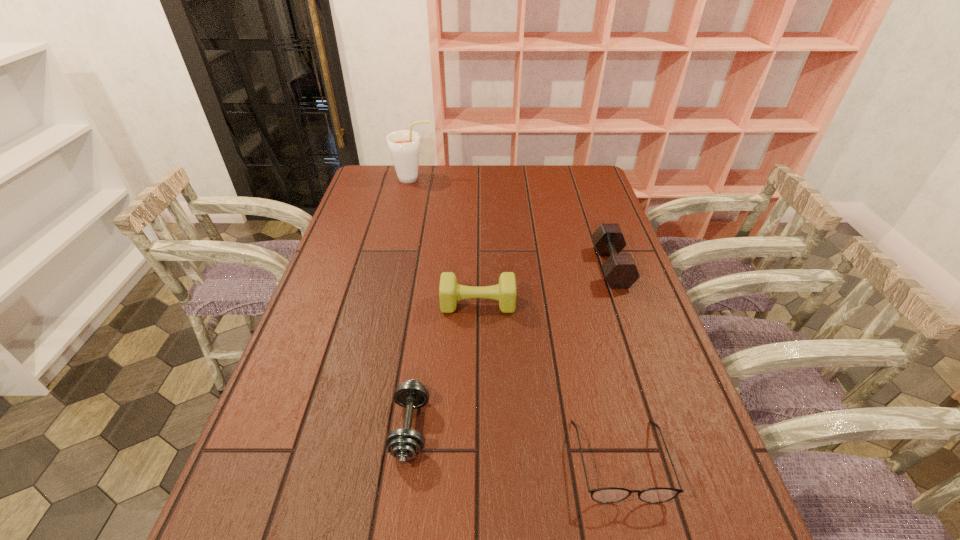
Image resolution: width=960 pixels, height=540 pixels. Find the location of `the farthest object`. the farthest object is located at coordinates (404, 145).

The image size is (960, 540). Identify the location of the tallest object. (404, 145).

Find the location of a particular element. the rightmost dumbbell is located at coordinates (620, 270).

In order to click on the farthest dumbbell in this screenshot , I will do `click(620, 270)`.

Where is `the second dumbbell from left to right`? the second dumbbell from left to right is located at coordinates (450, 292).

What are the coordinates of `the third farthest object` in the screenshot? It's located at (450, 292).

You are a GUI agent. You are given a task and a screenshot of the screen. Output one action in this format:
    pyautogui.click(x=<x>, y=<y>)
    Task: Click on the leftmost dumbbell
    The width and height of the screenshot is (960, 540).
    Given the screenshot: What is the action you would take?
    pyautogui.click(x=404, y=444)

Find the location of a particular element. the shortest object is located at coordinates (612, 494).

Where is `free space located on the drink side of the tallest object`? This screenshot has height=540, width=960. free space located on the drink side of the tallest object is located at coordinates (521, 179).

Where is `vacant area situated 0.150m on the left of the fourth nearest object`? vacant area situated 0.150m on the left of the fourth nearest object is located at coordinates (545, 267).